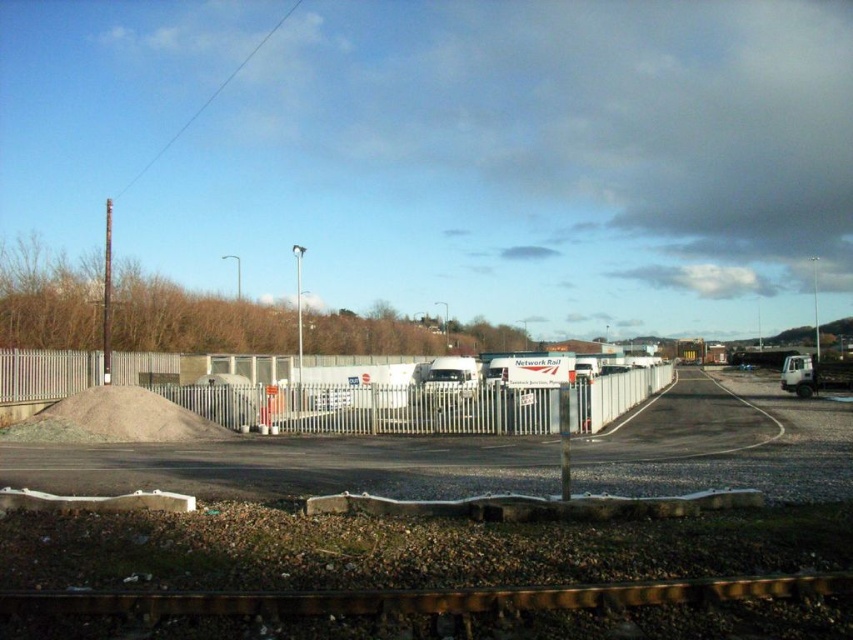
Measure the distance between metallic gold train track at bottom and white metal fence at center.

They are 29.35 meters apart.

Can you confirm if metallic gold train track at bottom is thinner than white metal fence at center?

Correct, metallic gold train track at bottom's width is less than white metal fence at center's.

Between point (543, 618) and point (332, 388), which one is positioned behind?

The point (332, 388) is more distant.

You are a GUI agent. You are given a task and a screenshot of the screen. Output one action in this format:
    pyautogui.click(x=<x>, y=<y>)
    Task: Click on the metallic gold train track at bottom
    The height and width of the screenshot is (640, 853).
    Given the screenshot: What is the action you would take?
    pyautogui.click(x=450, y=612)

Is gray gravel pile at lower left positioned at the back of white matte trailer truck at center?

No, gray gravel pile at lower left is in front of white matte trailer truck at center.

Image resolution: width=853 pixels, height=640 pixels. What do you see at coordinates (115, 419) in the screenshot?
I see `gray gravel pile at lower left` at bounding box center [115, 419].

Identify the location of gray gravel pile at lower left. This screenshot has height=640, width=853. (115, 419).

Is metallic gold train track at bottom further to the viewer compared to white matte trailer truck at center?

That is False.

Who is more distant from viewer, (15,595) or (460,374)?

Positioned behind is point (460,374).

Between point (845, 593) and point (422, 385), which one is positioned in front?

Point (845, 593)

In order to click on metallic gold train track at bottom in this screenshot , I will do `click(450, 612)`.